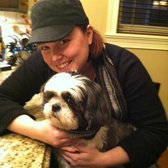
Locate an element on the screen. The width and height of the screenshot is (168, 168). white window sill is located at coordinates (139, 42).